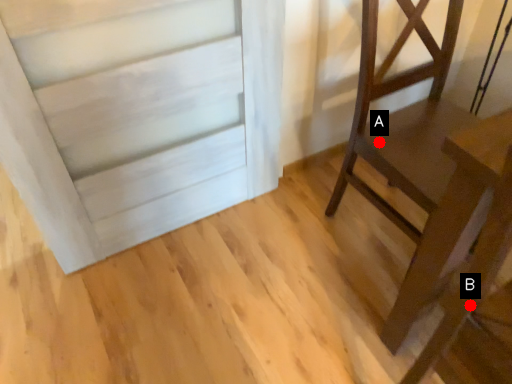
Question: Two points are circled on the image, labeled by A and B beside each circle. Which point is closer to the camera taking this photo?

Choices:
 (A) A is closer
 (B) B is closer

Answer: (B)